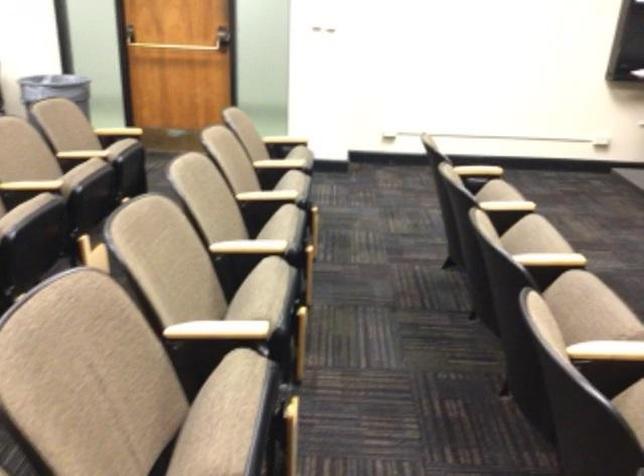
The first image is from the beginning of the video and the second image is from the end. How did the camera likely rotate when shooting the video?

The camera rotated toward right-down.